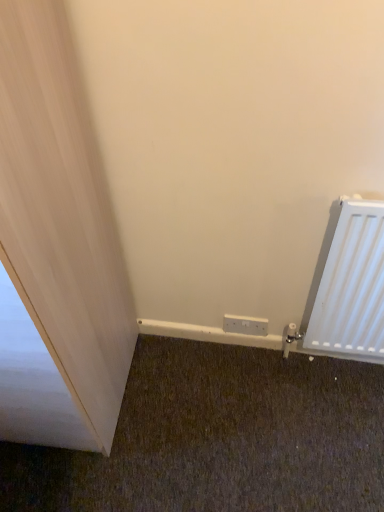
The height and width of the screenshot is (512, 384). What do you see at coordinates (349, 284) in the screenshot?
I see `white matte radiator at right` at bounding box center [349, 284].

At what (x,y) coordinates should I click in order to perform the action: click on white matte radiator at right. Please return your answer as a coordinate pair (x, y). The height and width of the screenshot is (512, 384). Looking at the image, I should click on (349, 284).

What do you see at coordinates (245, 325) in the screenshot? The width and height of the screenshot is (384, 512). I see `white plastic electric outlet at lower center` at bounding box center [245, 325].

Locate an element on the screen. white plastic electric outlet at lower center is located at coordinates (245, 325).

Identify the location of white matte radiator at right. (349, 284).

Between white plastic electric outlet at lower center and white matte radiator at right, which one appears on the left side from the viewer's perspective?

white plastic electric outlet at lower center.

Is white plastic electric outlet at lower center positioned in front of white matte radiator at right?

No.

Is point (240, 321) closer to viewer compared to point (320, 302)?

No, (240, 321) is further to viewer.

From the image's perspective, between white plastic electric outlet at lower center and white matte radiator at right, who is located below?

white plastic electric outlet at lower center is shown below in the image.

In the scene shown: From a real-world perspective, which is physically above, white plastic electric outlet at lower center or white matte radiator at right?

white matte radiator at right is physically above.

Is white plastic electric outlet at lower center thinner than white matte radiator at right?

Indeed, white plastic electric outlet at lower center has a lesser width compared to white matte radiator at right.

Is white plastic electric outlet at lower center taller than white matte radiator at right?

No, white plastic electric outlet at lower center is not taller than white matte radiator at right.

Who is smaller, white plastic electric outlet at lower center or white matte radiator at right?

Smaller between the two is white plastic electric outlet at lower center.

Choose the correct answer: Is white plastic electric outlet at lower center inside white matte radiator at right or outside it?

white plastic electric outlet at lower center is not enclosed by white matte radiator at right.

Are white plastic electric outlet at lower center and white matte radiator at right beside each other?

No, white plastic electric outlet at lower center is not in contact with white matte radiator at right.

Is white plastic electric outlet at lower center oriented towards white matte radiator at right?

No, white plastic electric outlet at lower center is not facing towards white matte radiator at right.

How far apart are white plastic electric outlet at lower center and white matte radiator at right?

white plastic electric outlet at lower center is 33.47 centimeters away from white matte radiator at right.

The image size is (384, 512). I want to click on radiator located above the white plastic electric outlet at lower center (from the image's perspective), so click(x=349, y=284).

Considering the relative positions of white matte radiator at right and white plastic electric outlet at lower center in the image provided, is white matte radiator at right to the left of white plastic electric outlet at lower center from the viewer's perspective?

In fact, white matte radiator at right is to the right of white plastic electric outlet at lower center.

Is white matte radiator at right positioned behind white plastic electric outlet at lower center?

No, it is not.

Which point is more forward, [339,340] or [252,326]?

Point [339,340]

From the image's perspective, is white matte radiator at right positioned above or below white plastic electric outlet at lower center?

white matte radiator at right is situated higher than white plastic electric outlet at lower center in the image.

From a real-world perspective, between white matte radiator at right and white plastic electric outlet at lower center, who is vertically higher?

white matte radiator at right is physically above.

In the scene shown: In terms of width, does white matte radiator at right look wider or thinner when compared to white plastic electric outlet at lower center?

Clearly, white matte radiator at right has more width compared to white plastic electric outlet at lower center.

From their relative heights in the image, would you say white matte radiator at right is taller or shorter than white plastic electric outlet at lower center?

white matte radiator at right is taller than white plastic electric outlet at lower center.

Which of these two, white matte radiator at right or white plastic electric outlet at lower center, is bigger?

white matte radiator at right.

Is white matte radiator at right positioned beyond the bounds of white plastic electric outlet at lower center?

That's correct, white matte radiator at right is outside of white plastic electric outlet at lower center.

Is white matte radiator at right far from white plastic electric outlet at lower center?

No, there isn't a large distance between white matte radiator at right and white plastic electric outlet at lower center.

Looking at this image, is white matte radiator at right positioned with its back to white plastic electric outlet at lower center?

No, white plastic electric outlet at lower center is not at the back of white matte radiator at right.

In order to click on electric outlet below the white matte radiator at right (from the image's perspective) in this screenshot , I will do `click(245, 325)`.

Find the location of `radiator that is on the right side of white plastic electric outlet at lower center`. radiator that is on the right side of white plastic electric outlet at lower center is located at coordinates [349, 284].

Where is `electric outlet below the white matte radiator at right (from a real-world perspective)`? The image size is (384, 512). electric outlet below the white matte radiator at right (from a real-world perspective) is located at coordinates (245, 325).